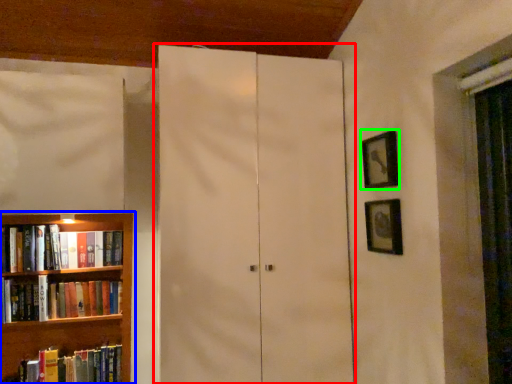
Question: Which object is the farthest from cupboard (highlighted by a red box)? Choose among these: bookcase (highlighted by a blue box) or picture frame (highlighted by a green box).

Choices:
 (A) bookcase
 (B) picture frame

Answer: (A)